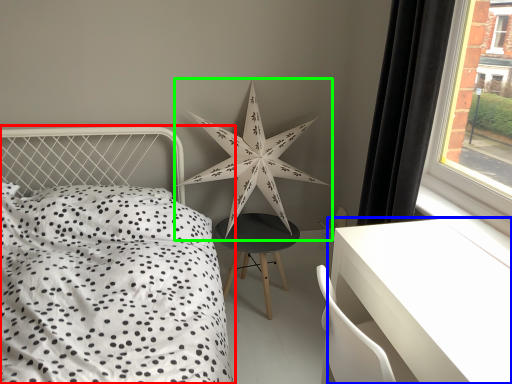
Question: Estimate the real-world distances between objects in this image. Which object is farther from bed (highlighted by a red box), table (highlighted by a blue box) or star (highlighted by a green box)?

Choices:
 (A) table
 (B) star

Answer: (A)